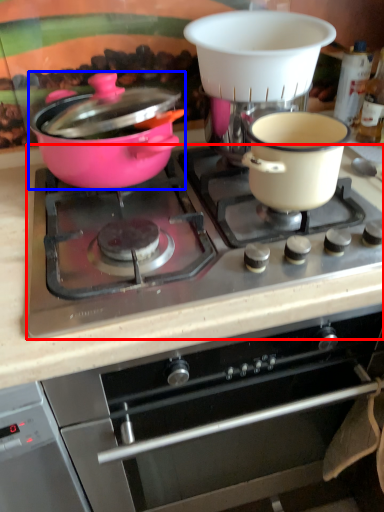
Question: Which object is closer to the camera taking this photo, gas stove (highlighted by a red box) or pot/pan (highlighted by a blue box)?

Choices:
 (A) gas stove
 (B) pot/pan

Answer: (A)